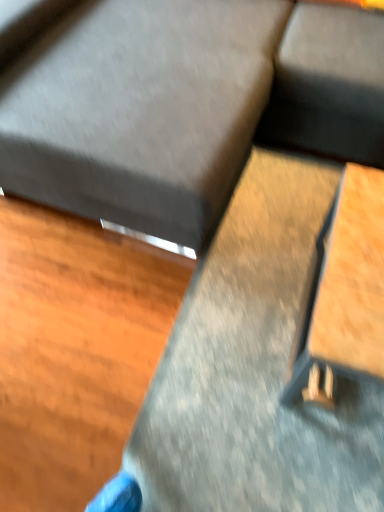
Image resolution: width=384 pixels, height=512 pixels. What do you see at coordinates (257, 367) in the screenshot? I see `textured gray concrete at center` at bounding box center [257, 367].

Locate an element on the screen. This screenshot has height=512, width=384. textured gray concrete at center is located at coordinates (257, 367).

Measure the distance between point (312, 305) and camera.

3.76 feet.

I want to click on textured gray concrete at center, so click(x=257, y=367).